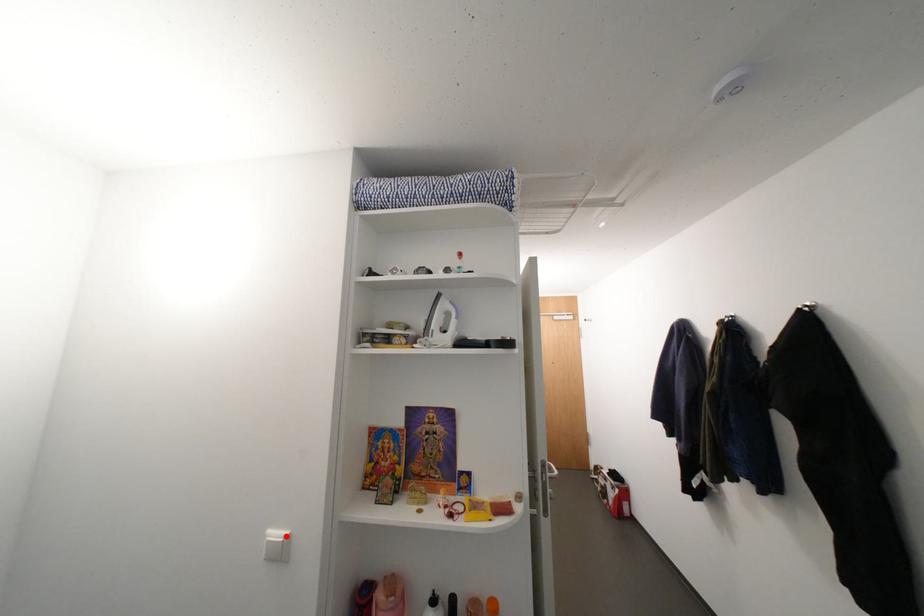
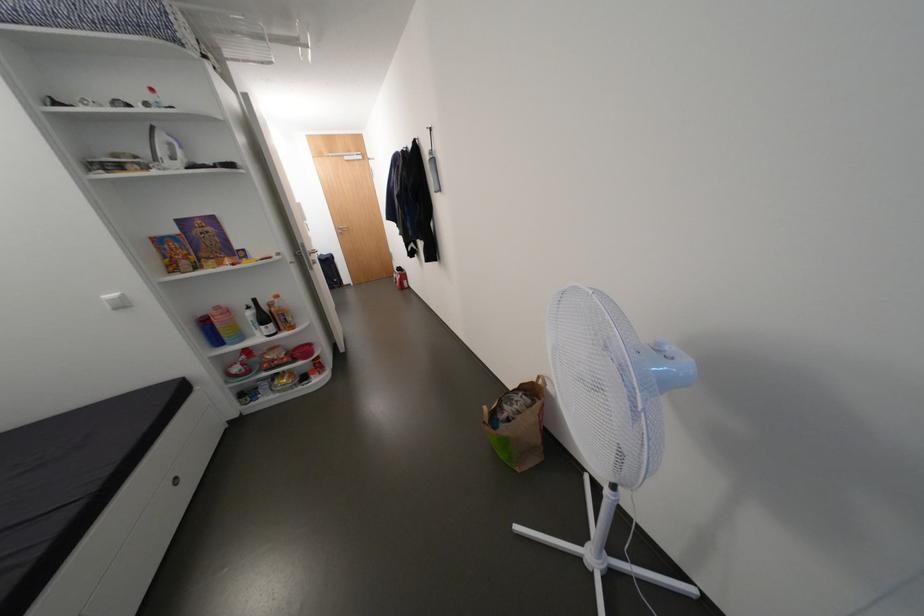
Locate, in the second image, the point that corresponds to the highlighted location in the first image.

(120, 296)